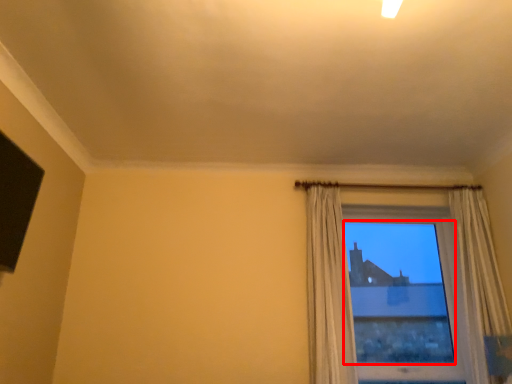
Question: From the image, what is the correct spatial relationship of window screen (annotated by the red box) in relation to curtain?

Choices:
 (A) right
 (B) left

Answer: (A)